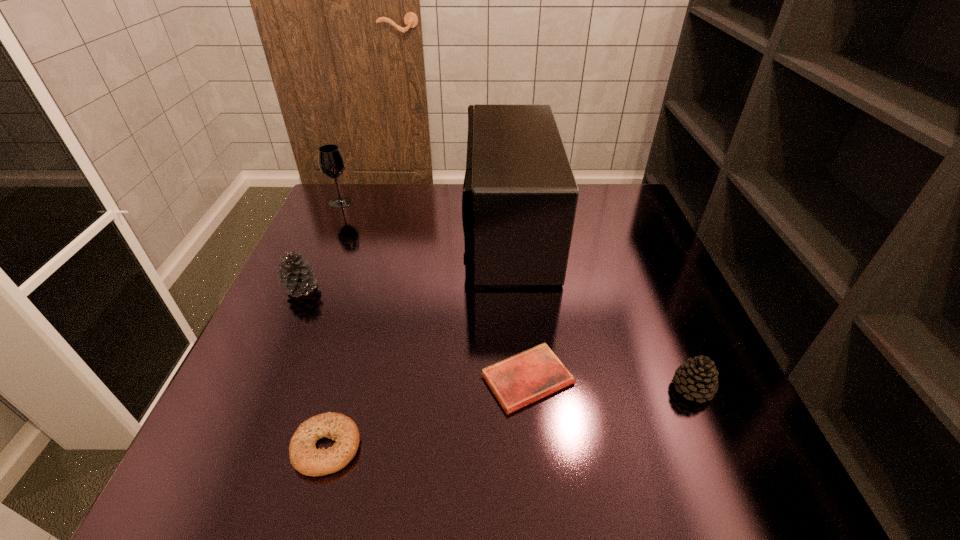
Locate an element on the screen. Image resolution: width=960 pixels, height=540 pixels. vacant point located between the left pinecone and the shortest object is located at coordinates (415, 334).

Locate an element on the screen. This screenshot has width=960, height=540. free area in between the wineglass and the third object from left to right is located at coordinates (334, 325).

This screenshot has width=960, height=540. I want to click on object that can be found as the fifth closest to the fourth object from right to left, so click(331, 162).

Locate an element on the screen. the third closest object to the taller pinecone is located at coordinates (519, 200).